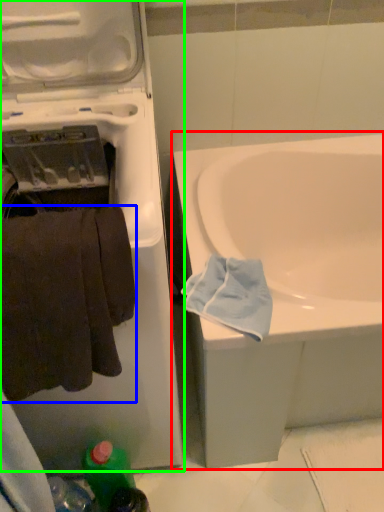
Question: Which object is positioned farthest from bathtub (highlighted by a red box)? Select from towel (highlighted by a blue box) and washing machine (highlighted by a green box).

Choices:
 (A) towel
 (B) washing machine

Answer: (A)